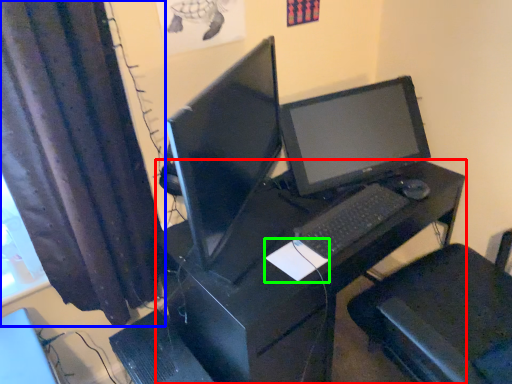
Question: Which object is the closest to the desk (highlighted by a red box)? Choose among these: curtain (highlighted by a blue box) or notepad (highlighted by a green box).

Choices:
 (A) curtain
 (B) notepad

Answer: (B)